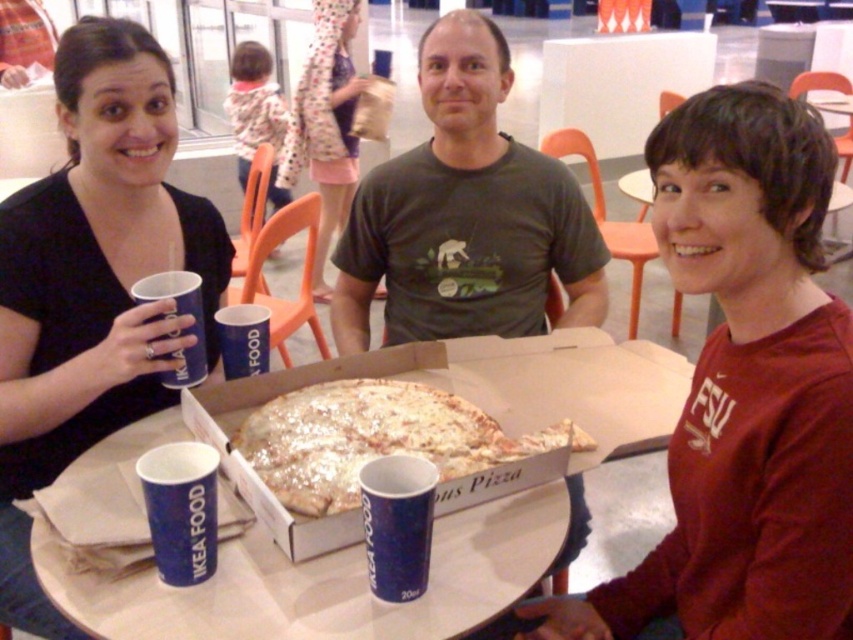
You are standing at the origin of the coordinate system. The point at (465, 214) is where the matte dark green t shirt is located. Which direction should you move to reach the matte dark green t shirt?

The point at (465, 214) corresponds to the matte dark green t shirt at center, so you should move towards the center to reach it.